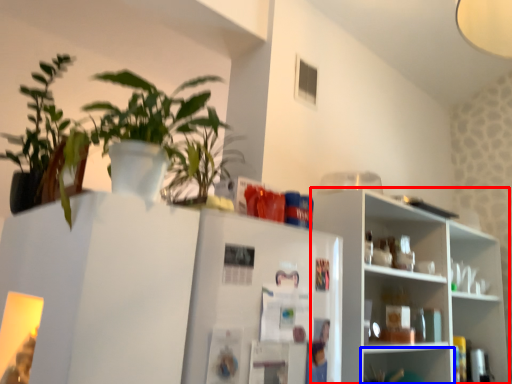
Question: Which object appears farthest to the camera in this image, shelf (highlighted by a red box) or shelf (highlighted by a blue box)?

Choices:
 (A) shelf
 (B) shelf

Answer: (B)